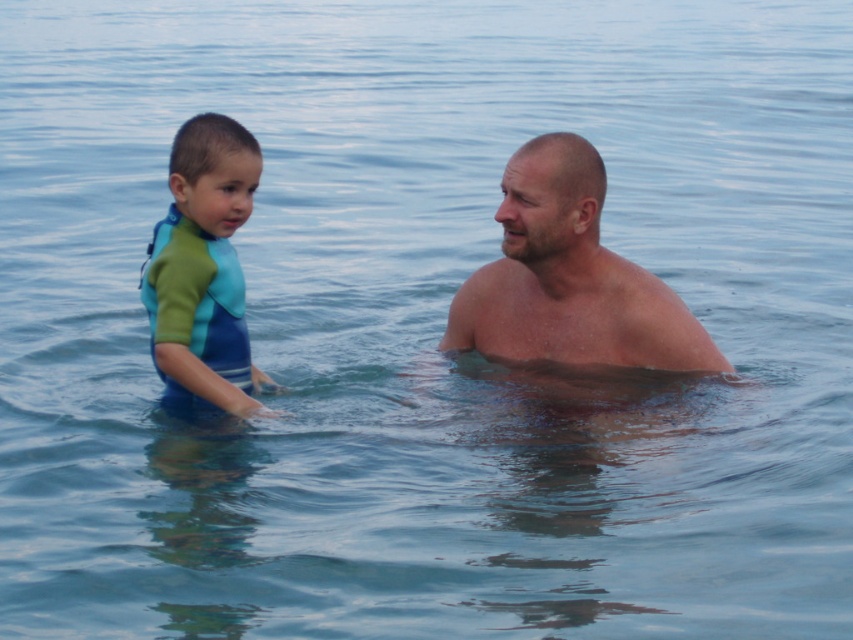
Question: Which of the following is the farthest from the observer?

Choices:
 (A) green-blue wetsuit at left
 (B) smooth skin man at center

Answer: (B)

Question: Does smooth skin man at center appear under green-blue wetsuit at left?

Choices:
 (A) no
 (B) yes

Answer: (B)

Question: Can you confirm if smooth skin man at center is positioned to the left of green-blue wetsuit at left?

Choices:
 (A) yes
 (B) no

Answer: (B)

Question: Among these points, which one is farthest from the camera?

Choices:
 (A) (523, 256)
 (B) (160, 362)

Answer: (A)

Question: Which of the following is the farthest from the observer?

Choices:
 (A) green-blue wetsuit at left
 (B) smooth skin man at center

Answer: (B)

Question: Is smooth skin man at center further to camera compared to green-blue wetsuit at left?

Choices:
 (A) no
 (B) yes

Answer: (B)